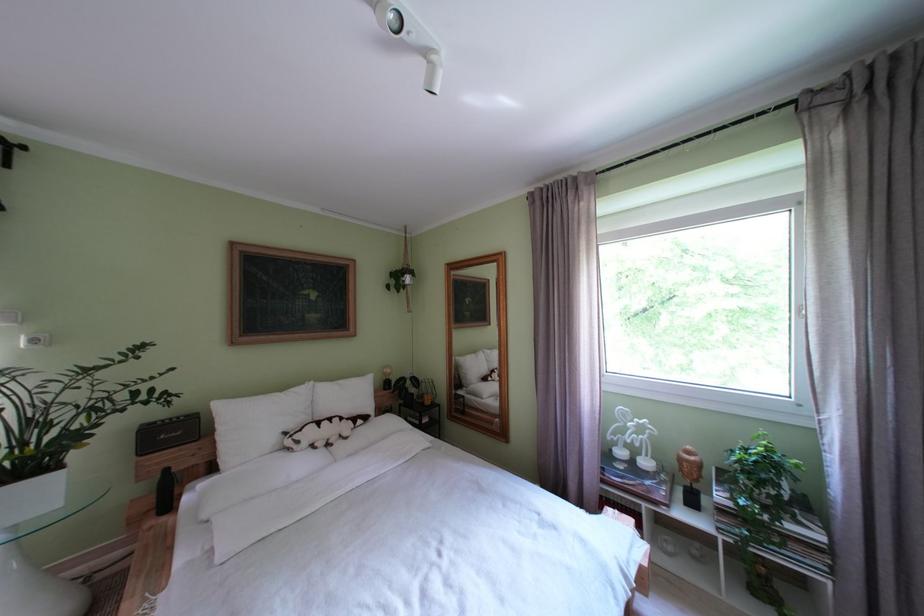
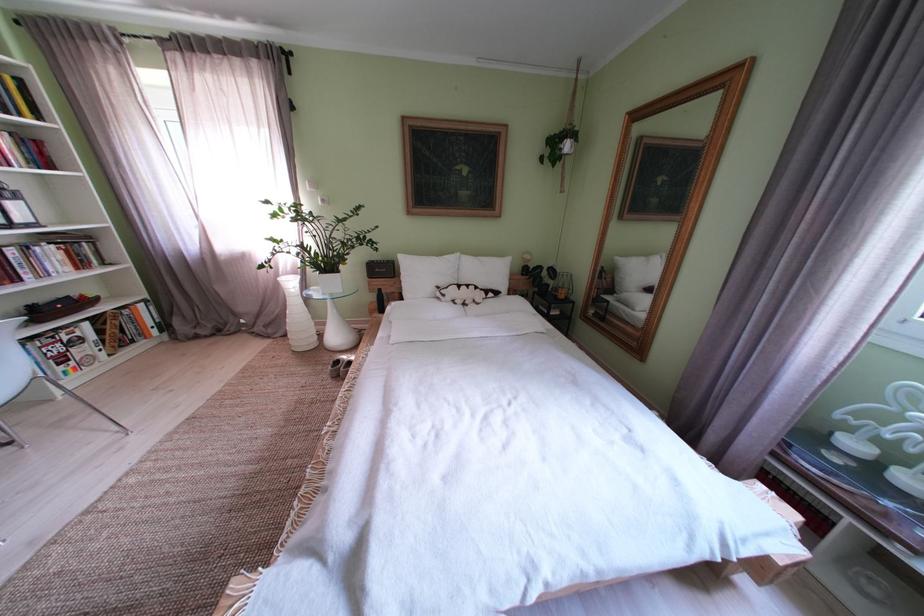
The point at (261, 429) is marked in the first image. Where is the corresponding point in the second image?

(429, 280)